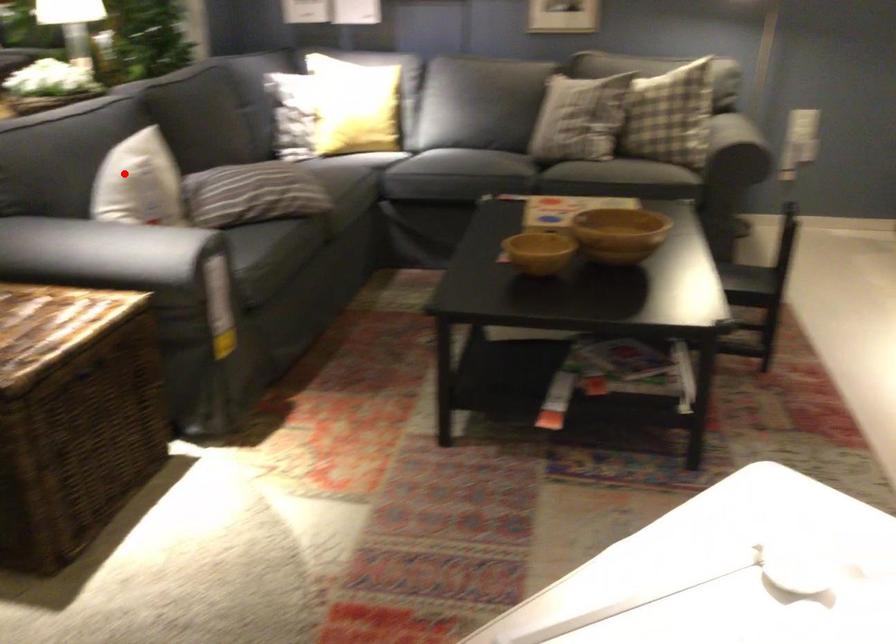
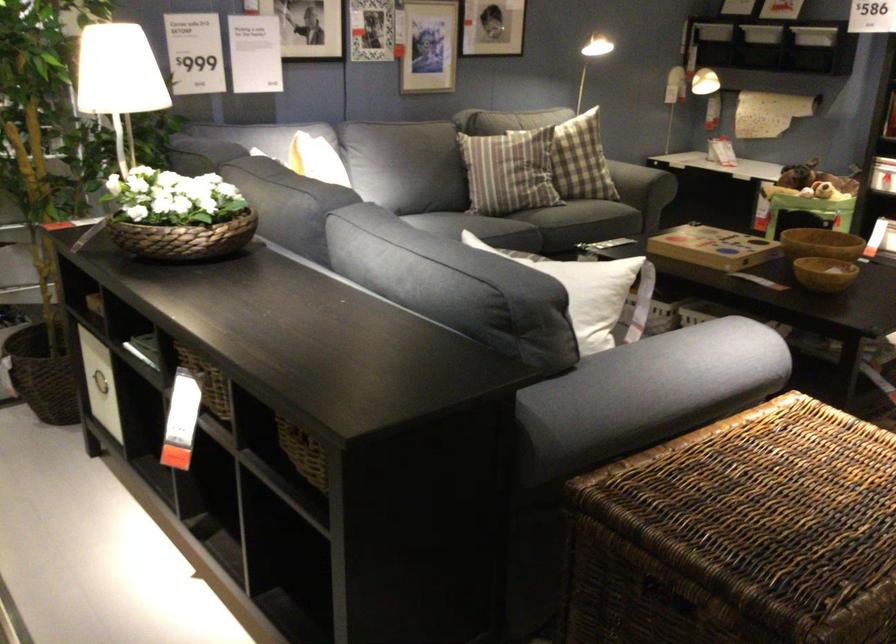
Where in the second image is the point corresponding to the highlighted location from the first image?

(581, 272)